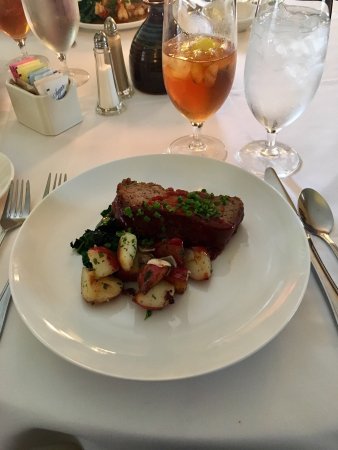
Image resolution: width=338 pixels, height=450 pixels. In order to click on sugar packets in this screenshot , I will do `click(46, 68)`.